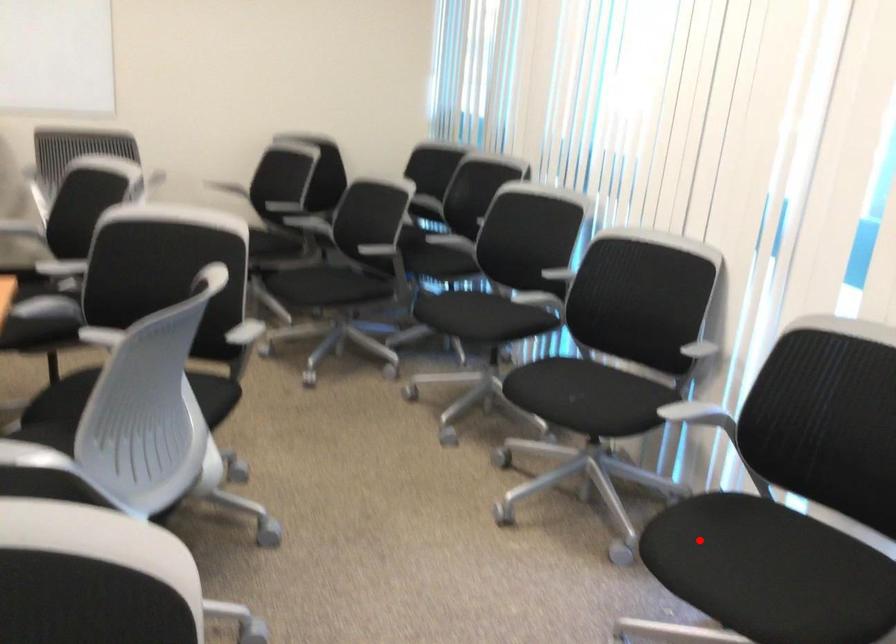
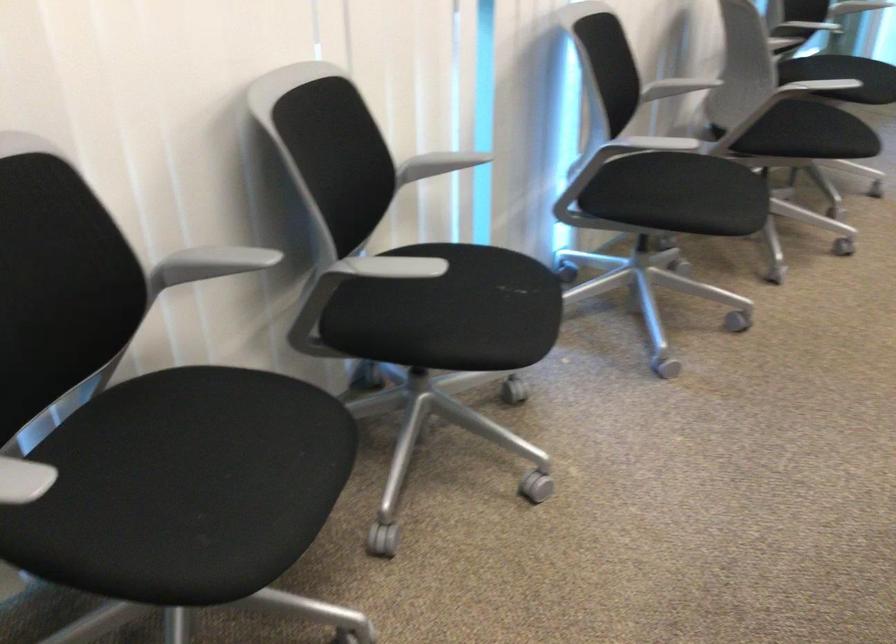
Question: A red point is marked in image1. In image2, is the corresponding 3D point closer to the camera or farther? Reply with the corresponding letter.

Choices:
 (A) The corresponding 3D point is closer.
 (B) The corresponding 3D point is farther.

Answer: (B)